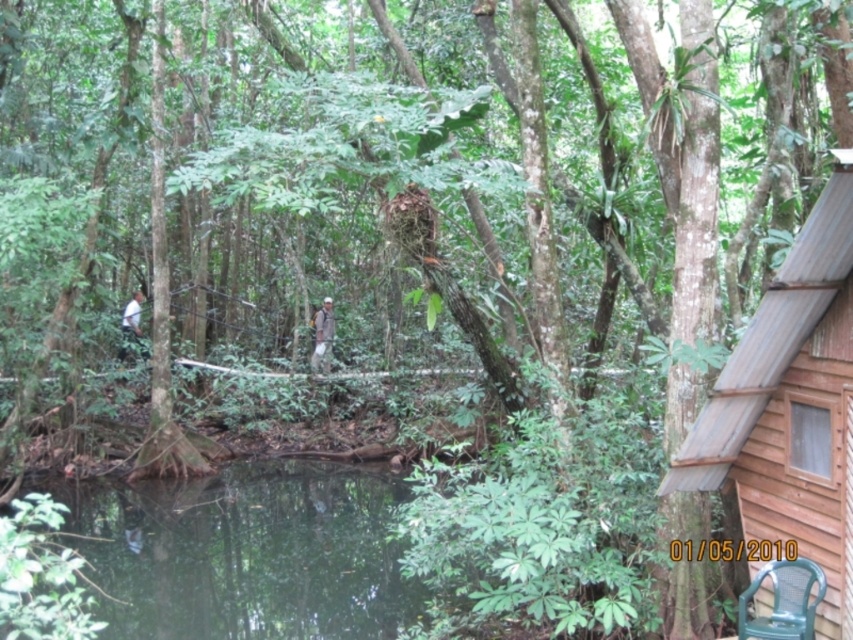
You are standing in the forest and want to reach the point marked as point (781, 326). If your walking speed is 1.5 meters per second, how long will it take you to reach that point?

The point (781, 326) is 4.66 meters away from the viewer. At a walking speed of 1.5 meters per second, it would take approximately 3.11 seconds to reach it.

You are standing in the forest and want to reach the point marked as point [680,465]. If your walking speed is 1.5 meters per second, how long will it take you to reach the point?

The point [680,465] is 5.08 meters from the viewer. At a speed of 1.5 meters per second, it will take approximately 3.39 seconds to reach the point.

You are a hiker who needs to store your gear in the nearest structure. You see a brown wooden cabin at right and a brown fabric backpack at center. Which object is taller and can provide shelter?

The brown wooden cabin at right is much taller than the brown fabric backpack at center, so it can provide shelter.